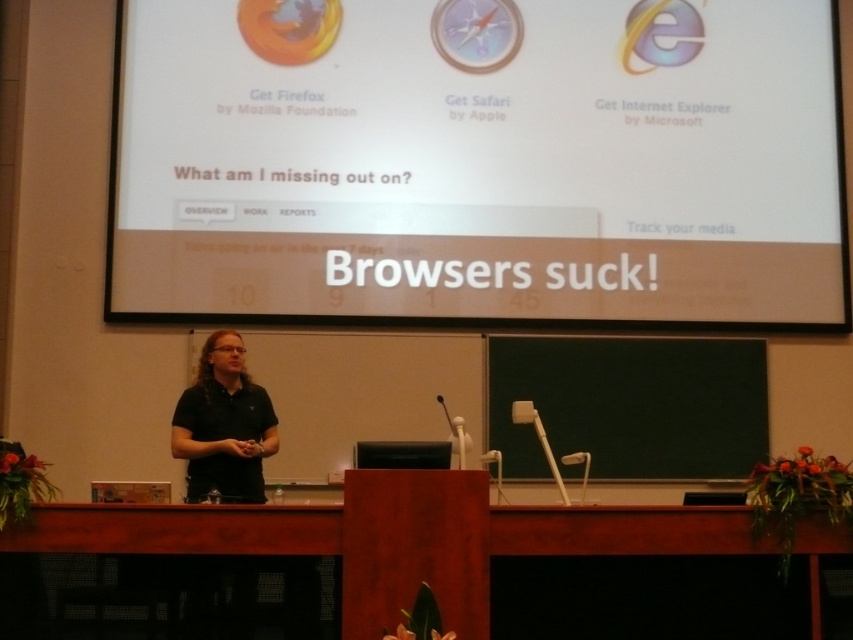
The width and height of the screenshot is (853, 640). Describe the element at coordinates (479, 163) in the screenshot. I see `white text on projector screen at upper center` at that location.

In the scene shown: Is white text on projector screen at upper center taller than black matte shirt at center?

Yes.

What are the coordinates of `white text on projector screen at upper center` in the screenshot? It's located at pyautogui.click(x=479, y=163).

The width and height of the screenshot is (853, 640). Find the location of `white text on projector screen at upper center`. white text on projector screen at upper center is located at coordinates 479,163.